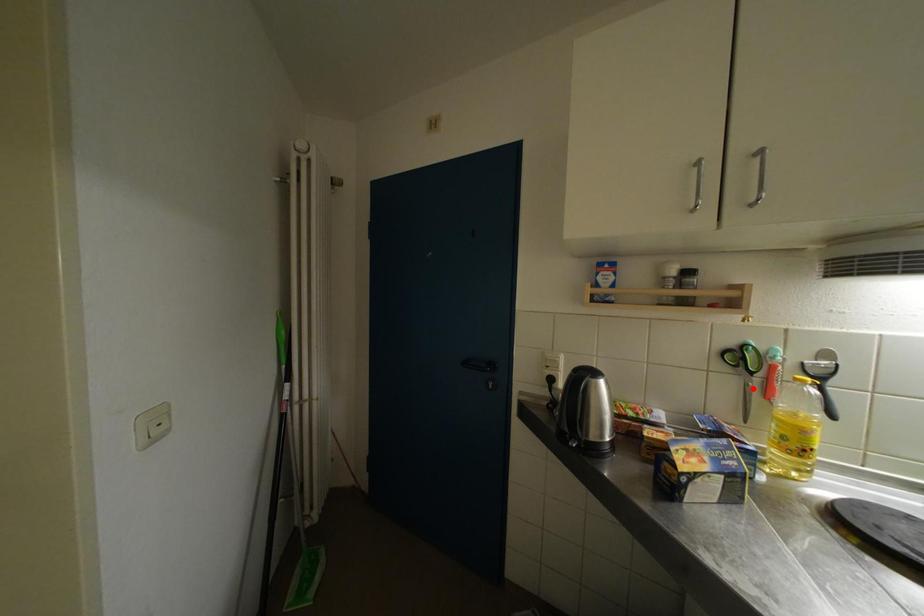
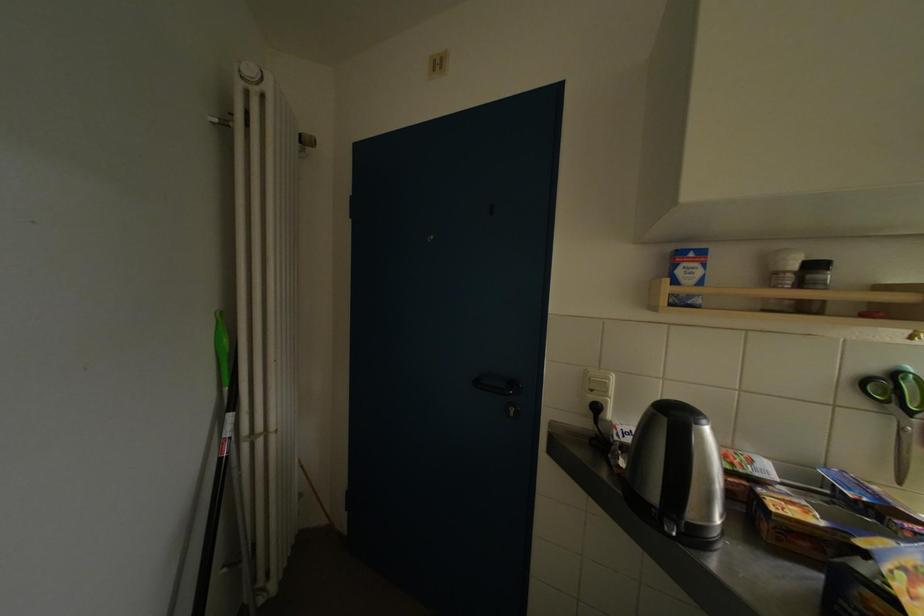
In the second image, find the point that corresponds to the highlighted location in the first image.

(908, 434)